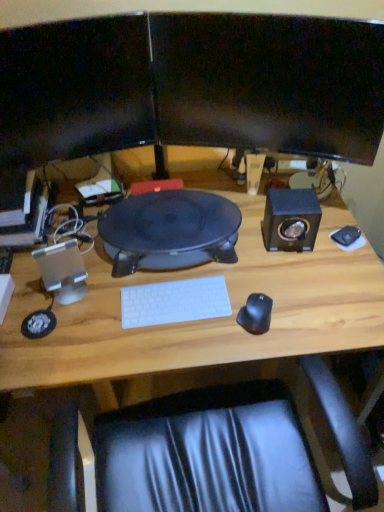
The width and height of the screenshot is (384, 512). Identify the location of vacant space that is to the left of black rubberized mouse at right, the second mouse viewed from the back. (200, 335).